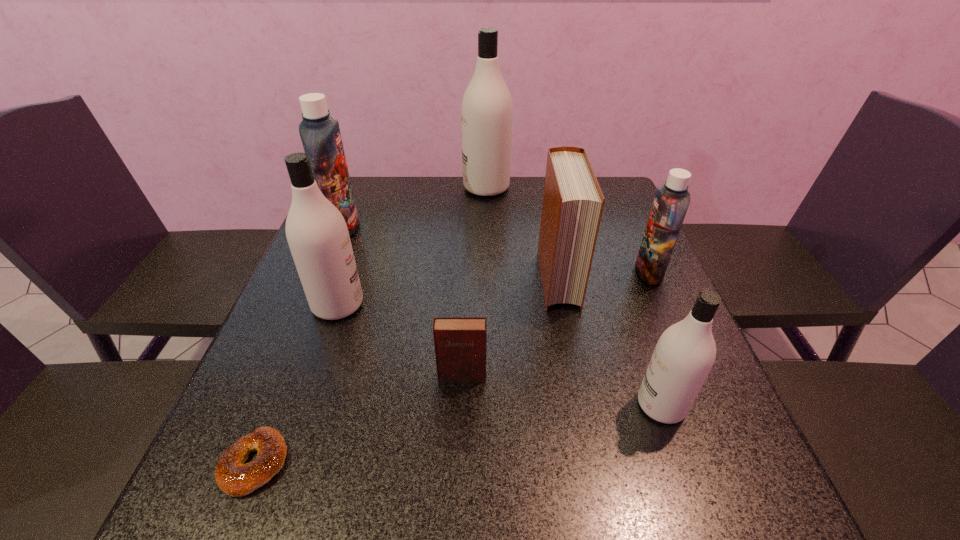
Find the location of a particular element. the second white shampoo from right to left is located at coordinates (487, 109).

Identify the location of the farthest white shampoo. (487, 109).

Identify the location of the farther blue shampoo. (320, 134).

In order to click on the seventh nearest object in this screenshot , I will do `click(320, 134)`.

Find the location of a particular element. The image size is (960, 540). the leftmost white shampoo is located at coordinates (317, 234).

Locate an element on the screen. the second nearest white shampoo is located at coordinates (317, 234).

Identify the location of the third object from right to left. (573, 201).

Locate an element on the screen. the right blue shampoo is located at coordinates [670, 204].

Locate an element on the screen. This screenshot has width=960, height=540. the rightmost shampoo is located at coordinates (670, 204).

I want to click on the nearest shampoo, so click(x=685, y=352).